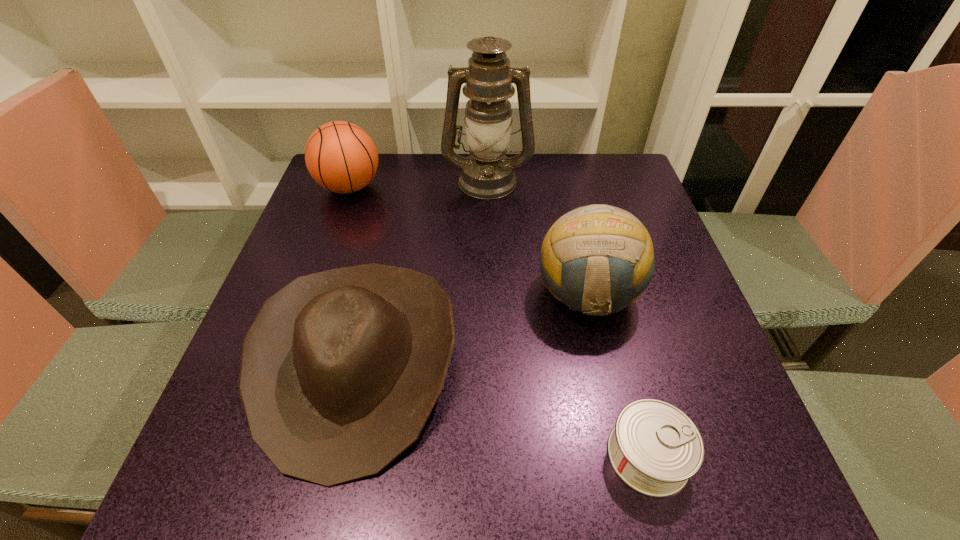
What are the coordinates of `the tallest object` in the screenshot? It's located at (487, 173).

At what (x,y) coordinates should I click in order to perform the action: click on volleyball. Please return your answer as a coordinate pair (x, y). The image size is (960, 540). Looking at the image, I should click on (597, 259).

The width and height of the screenshot is (960, 540). Identify the location of basketball. (340, 156).

You are a GUI agent. You are given a task and a screenshot of the screen. Output one action in this format:
    pyautogui.click(x=<x>, y=<y>)
    Task: Click on the second shortest object
    This screenshot has height=540, width=960.
    Given the screenshot: What is the action you would take?
    pyautogui.click(x=340, y=370)

Image resolution: width=960 pixels, height=540 pixels. I want to click on can, so click(654, 447).

Locate an element on the screen. blank space located on the right of the oil lamp is located at coordinates (590, 180).

Locate an element on the screen. This screenshot has height=540, width=960. free point located 0.190m on the left of the volleyball is located at coordinates (444, 294).

Locate an element on the screen. This screenshot has height=540, width=960. blank area located on the right of the basketball is located at coordinates (x=511, y=187).

Where is `free space located on the right of the cowboy hat`? The image size is (960, 540). free space located on the right of the cowboy hat is located at coordinates (518, 362).

You are a GUI agent. You are given a task and a screenshot of the screen. Output one action in this format:
    pyautogui.click(x=<x>, y=<y>)
    Task: Click on the free location located on the back of the shortest object
    
    Given the screenshot: What is the action you would take?
    pyautogui.click(x=601, y=277)